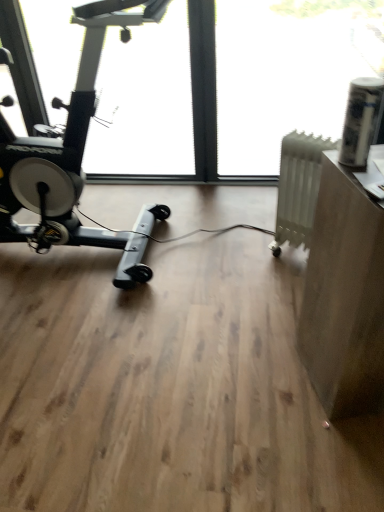
At what (x,y) coordinates should I click in order to perform the action: click on free area in between matte brown desk at right and transparent glass window at center, the 2th window screen when ordered from right to left. Please return your answer as a coordinate pair (x, y). Looking at the image, I should click on (165, 334).